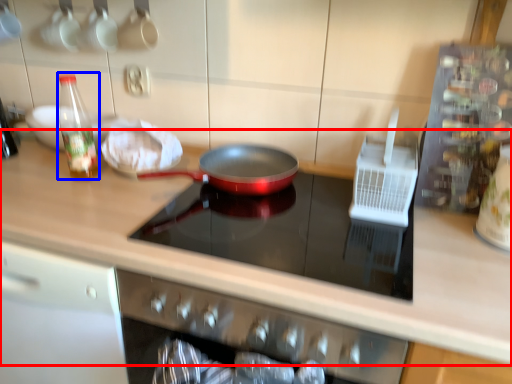
Question: Which point is further to the camera, countertop (highlighted by a red box) or bottle (highlighted by a blue box)?

Choices:
 (A) countertop
 (B) bottle

Answer: (B)